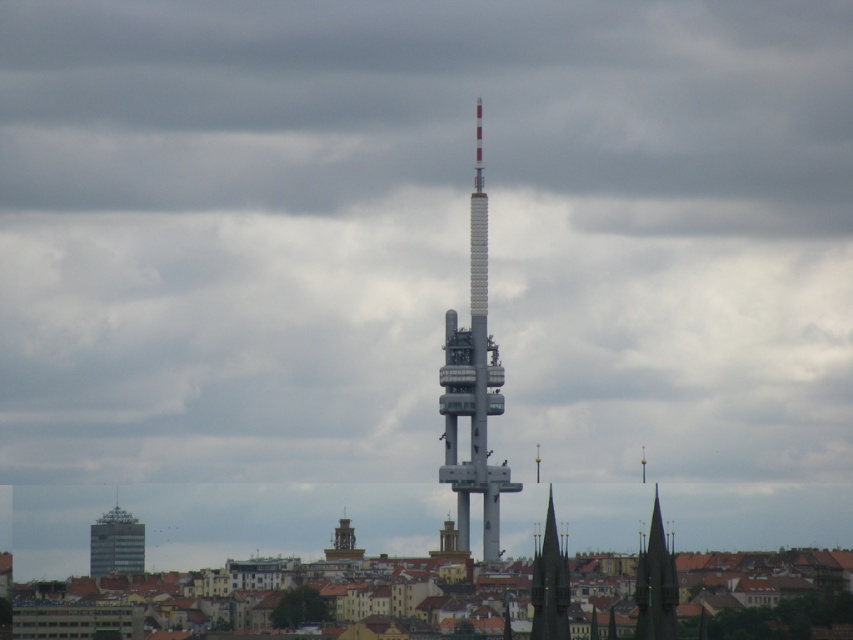
Consider the image. Who is shorter, white metallic tower at center or golden stone clock tower at center?

With less height is golden stone clock tower at center.

Measure the distance between white metallic tower at center and golden stone clock tower at center.

white metallic tower at center and golden stone clock tower at center are 29.71 meters apart.

Where is `white metallic tower at center`? The height and width of the screenshot is (640, 853). white metallic tower at center is located at coordinates (x=473, y=385).

Can you confirm if white metallic tower at center is positioned to the left of matte gray building at lower left?

Incorrect, white metallic tower at center is not on the left side of matte gray building at lower left.

Does point (497, 502) come in front of point (103, 516)?

Yes.

You are a GUI agent. You are given a task and a screenshot of the screen. Output one action in this format:
    pyautogui.click(x=<x>, y=<y>)
    Task: Click on the white metallic tower at center
    The height and width of the screenshot is (640, 853).
    Given the screenshot: What is the action you would take?
    pyautogui.click(x=473, y=385)

Which is behind, point (451, 376) or point (656, 547)?

Positioned behind is point (656, 547).

Can you confirm if white metallic tower at center is shorter than dark green stone spire at lower right?

Result: In fact, white metallic tower at center may be taller than dark green stone spire at lower right.

Who is more forward, (457, 339) or (641, 563)?

Point (457, 339) is in front.

Find the location of a particular element. Image resolution: width=853 pixels, height=640 pixels. white metallic tower at center is located at coordinates click(x=473, y=385).